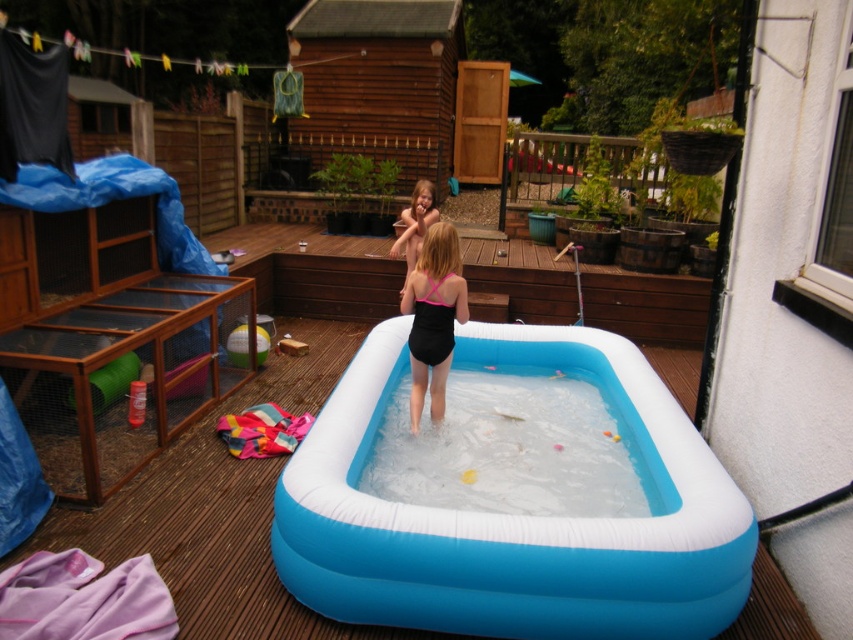
Question: Is blue inflatable pool at center to the right of black matte swimsuit at center from the viewer's perspective?

Choices:
 (A) no
 (B) yes

Answer: (B)

Question: Is black matte swimsuit at center to the right of pink matte swimsuit at center from the viewer's perspective?

Choices:
 (A) yes
 (B) no

Answer: (A)

Question: Which object is positioned farthest from the pink matte swimsuit at center?

Choices:
 (A) black matte swimsuit at center
 (B) blue inflatable pool at center

Answer: (B)

Question: Which point is closer to the camera?

Choices:
 (A) (427, 195)
 (B) (428, 256)
 (C) (403, 536)

Answer: (C)

Question: Which point appears closest to the camera in this image?

Choices:
 (A) (451, 234)
 (B) (431, 200)
 (C) (396, 364)

Answer: (A)

Question: Can you confirm if black matte swimsuit at center is wider than pink matte swimsuit at center?

Choices:
 (A) yes
 (B) no

Answer: (B)